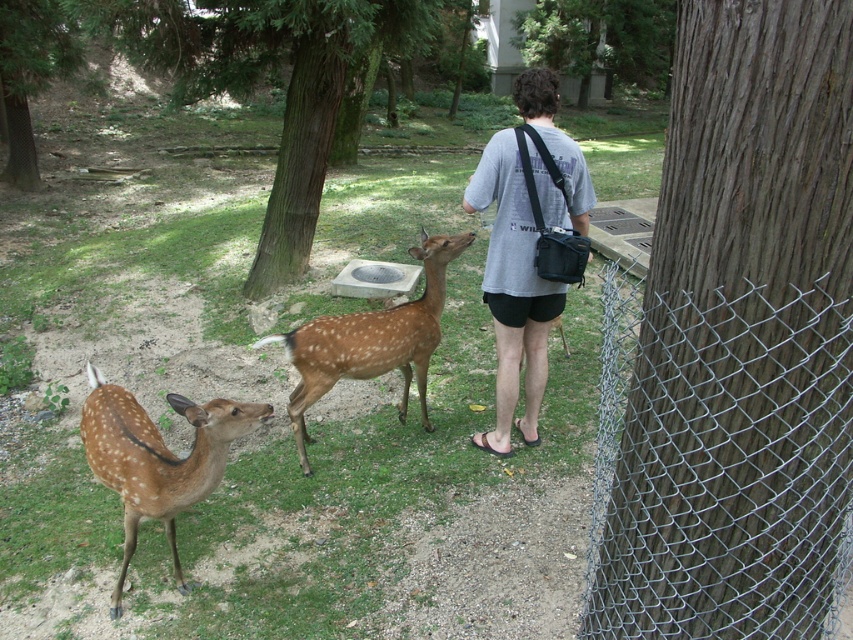
You are a park ranger who needs to determine the relative sizes of the objects in the scene. Based on the image, which object is smaller between the brown rough bark tree at center right and the spotted fur deer at lower left?

The brown rough bark tree at center right is smaller than the spotted fur deer at lower left according to the description.

You are a photographer trying to capture a photo of the spotted fur deer at lower left and the green textured tree at upper left in the background. Based on their positions, will the deer be to the left or right of the tree in your photo?

The spotted fur deer at lower left is positioned on the right side of the green textured tree at upper left, so in the photo, the deer will be to the right of the tree.